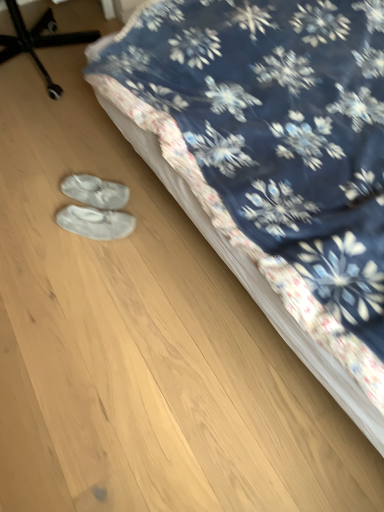
The image size is (384, 512). In order to click on vacant space behind white fabric shoe covers at lower left, arranged as the second footwear when ordered from the bottom in this screenshot , I will do `click(98, 163)`.